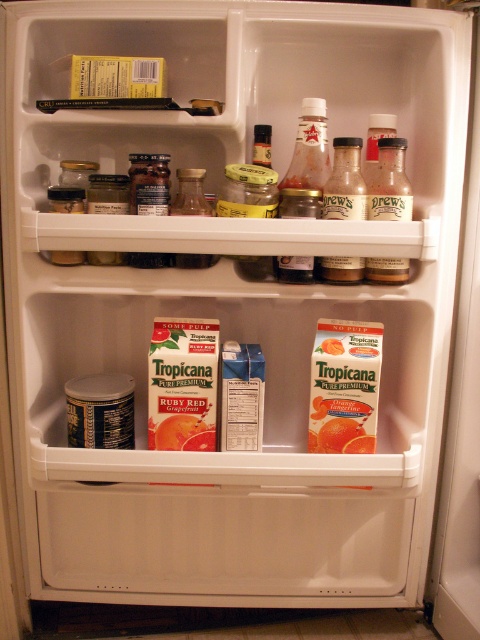
Question: Does matte glass bottle at upper right lie behind clear glass jar at center?

Choices:
 (A) yes
 (B) no

Answer: (B)

Question: Where is matte glass bottle at upper right located in relation to clear glass jar at center in the image?

Choices:
 (A) below
 (B) above

Answer: (B)

Question: Which object appears farthest from the camera in this image?

Choices:
 (A) clear glass bottle at upper right
 (B) clear glass jar at center

Answer: (A)

Question: Which point is farther to the camera?

Choices:
 (A) clear glass bottle at upper right
 (B) clear glass jar at center

Answer: (A)

Question: Does translucent glass jar at upper center have a larger size compared to clear glass jar at center?

Choices:
 (A) no
 (B) yes

Answer: (A)

Question: Which point appears farthest from the camera in this image?

Choices:
 (A) (180, 259)
 (B) (374, 180)

Answer: (B)